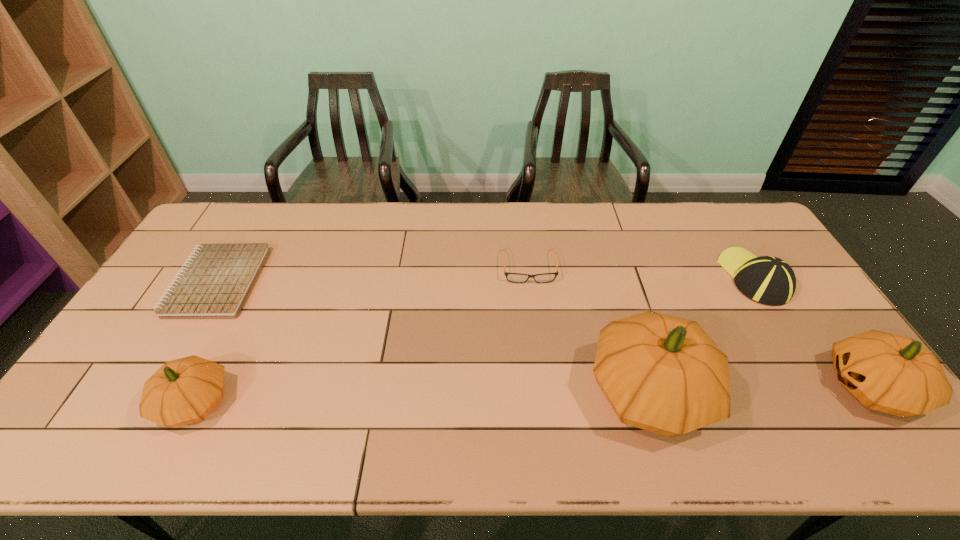
Where is `the leftmost gourd`? This screenshot has height=540, width=960. the leftmost gourd is located at coordinates (183, 391).

At what (x,y) coordinates should I click in order to perform the action: click on the fourth shortest object. Please return your answer as a coordinate pair (x, y). This screenshot has height=540, width=960. Looking at the image, I should click on coord(183,391).

Image resolution: width=960 pixels, height=540 pixels. I want to click on the tallest gourd, so click(664, 374).

Find the location of a particular element. The height and width of the screenshot is (540, 960). the tallest object is located at coordinates (664, 374).

Find the location of a particular element. Image resolution: width=960 pixels, height=540 pixels. the second shortest gourd is located at coordinates pyautogui.click(x=894, y=374).

Where is `the second tallest object`? the second tallest object is located at coordinates (894, 374).

You are a GUI agent. You are given a task and a screenshot of the screen. Output one action in this format:
    pyautogui.click(x=<x>, y=<y>)
    Task: Click on the baseball cap
    
    Given the screenshot: What is the action you would take?
    pyautogui.click(x=769, y=280)

At what (x,y) coordinates should I click in order to perform the action: click on notebook. Please return your answer as a coordinate pair (x, y). Image resolution: width=960 pixels, height=540 pixels. Looking at the image, I should click on (215, 283).

I want to click on spectacles, so click(511, 277).

Where is `the second shortest object`? The width and height of the screenshot is (960, 540). the second shortest object is located at coordinates (511, 277).